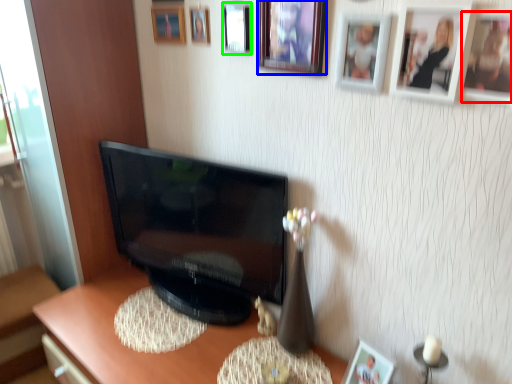
Question: Estimate the real-world distances between objects in this image. Which object is closer to picture frame (highlighted by a red box), picture frame (highlighted by a blue box) or picture frame (highlighted by a green box)?

Choices:
 (A) picture frame
 (B) picture frame

Answer: (A)